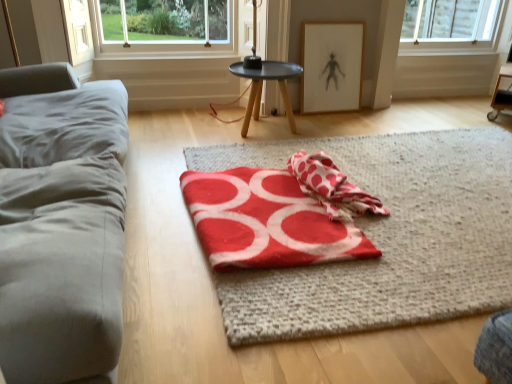
The height and width of the screenshot is (384, 512). I want to click on free space between red polka dot towel at center, which appears as the 1th beach towel when viewed from the right, and red felt beach towel at center, which is the first beach towel in left-to-right order, so click(380, 236).